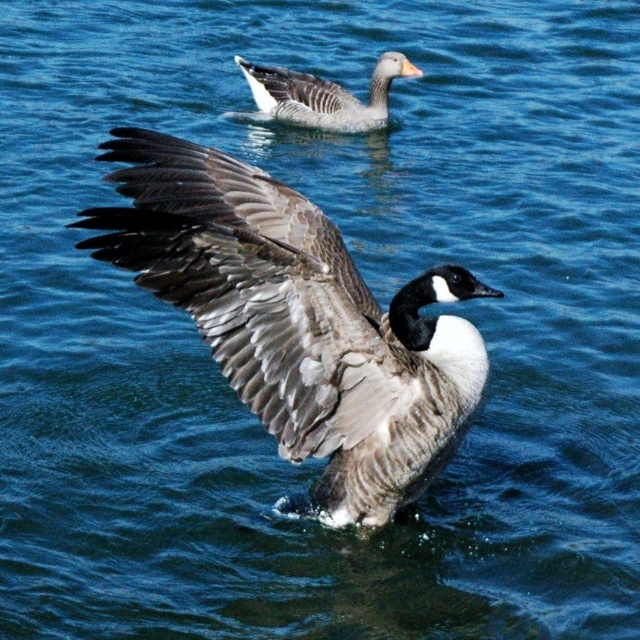
Which of these two, gray-brown feathered goose at center or gray matte duck at upper center, stands shorter?

gray matte duck at upper center

Between point (212, 344) and point (312, 108), which one is positioned in front?

Point (212, 344) is more forward.

This screenshot has width=640, height=640. I want to click on gray-brown feathered goose at center, so click(x=298, y=321).